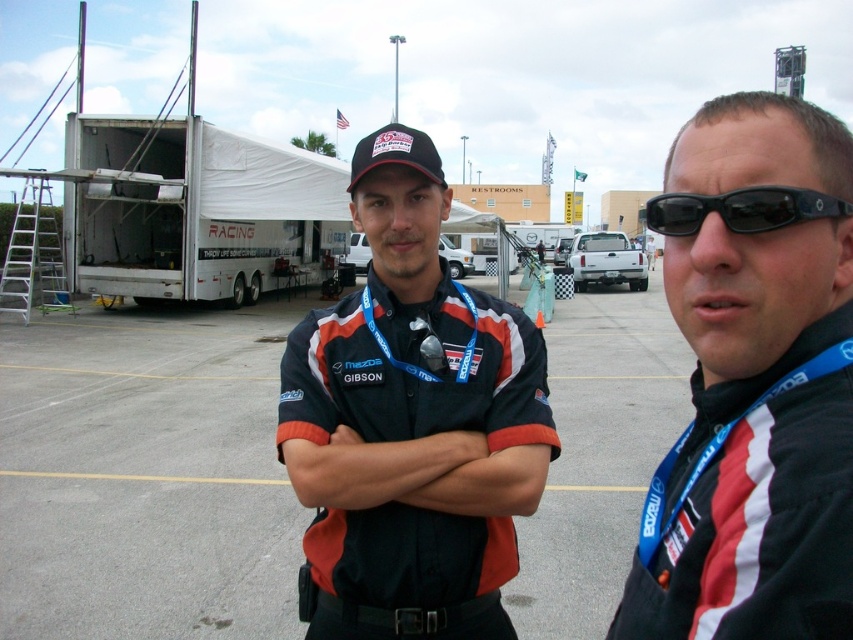
Based on the photo, you are a photographer at a motorsport event. You need to place a small tripod between the gray asphalt parking lot at center and the black plastic sunglasses at right. Which object should the tripod be closer to?

The gray asphalt parking lot at center is positioned on the left side of black plastic sunglasses at right, so the tripod should be placed closer to the gray asphalt parking lot at center since it is to the left of the sunglasses.

You are a photographer at a motorsport event. You need to capture a closeup shot of the matte black shirt at center and the black plastic sunglasses at right. Given that your camera can focus on objects within a 28 inch range, will both items be in focus?

The matte black shirt at center and black plastic sunglasses at right are 29.17 inches apart, which exceeds the camera focus range of 28 inches. Therefore, both items cannot be in focus simultaneously.

You are a photographer at the racing event. You need to place a banner between the two individuals so that it doesn not block either of them. The banner must be placed at the point marked by the coordinates given. Is the banner placed at point (753,381) between the two individuals?

The point (753,381) marks the black fabric shirt at center, so the banner placed there would be directly on the black fabric shirt at center, not between the two individuals.